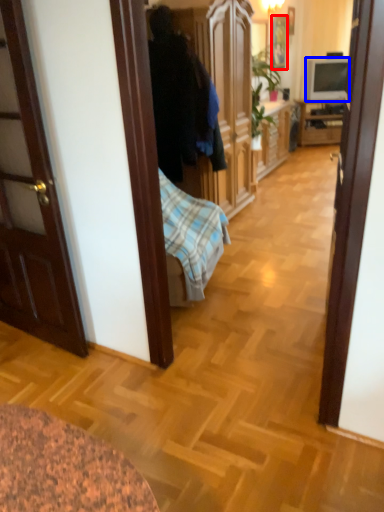
Question: Which point is closer to the camera, picture frame (highlighted by a red box) or television (highlighted by a blue box)?

Choices:
 (A) picture frame
 (B) television

Answer: (A)